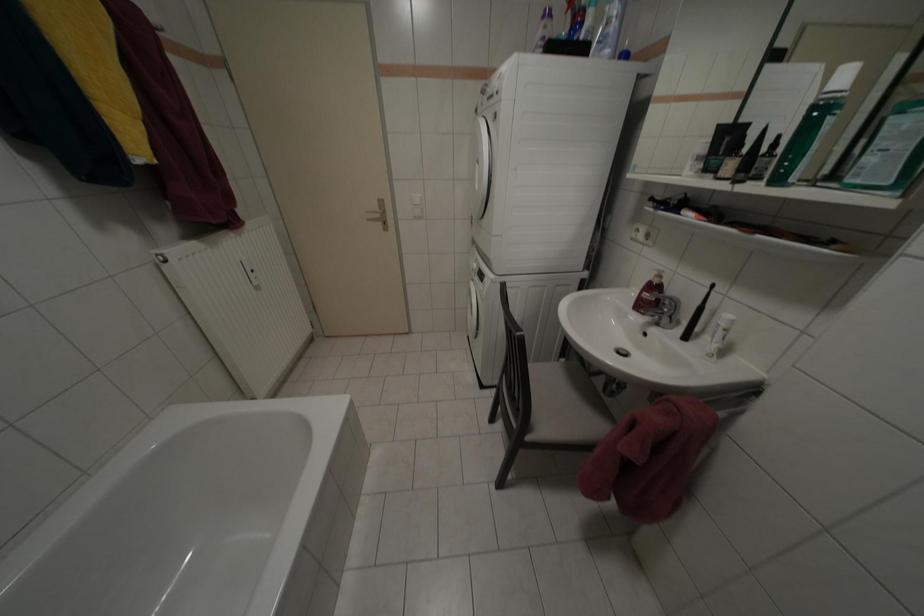
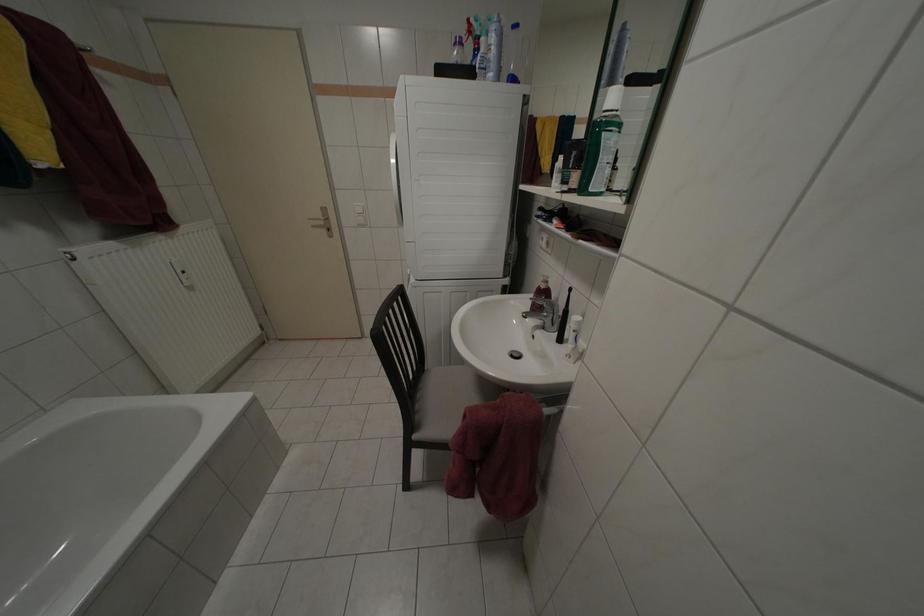
Question: Which direction would the cameraman need to move to produce the second image? Reply with the corresponding letter.

Choices:
 (A) Left
 (B) Right
 (C) Forward
 (D) Backward

Answer: (B)